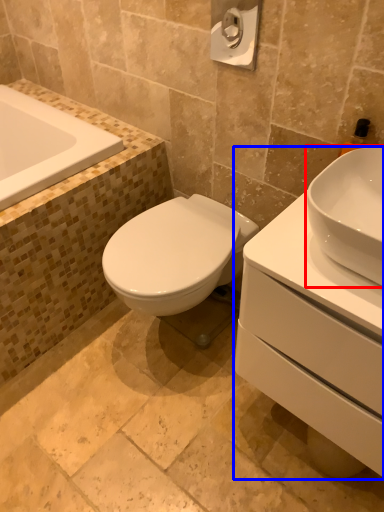
Question: Among these objects, which one is nearest to the camera, sink (highlighted by a red box) or porcelain (highlighted by a blue box)?

Choices:
 (A) sink
 (B) porcelain

Answer: (B)